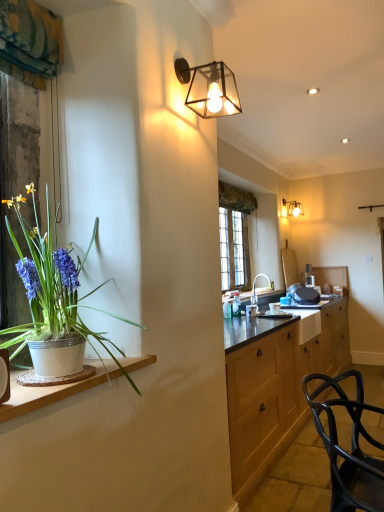
Question: Considering the positions of point click(x=296, y=205) and point click(x=8, y=416), is point click(x=296, y=205) closer or farther from the camera than point click(x=8, y=416)?

Choices:
 (A) closer
 (B) farther

Answer: (B)

Question: Is matte glass wall sconce at upper right, placed as the 1th lamp when sorted from back to front, wider or thinner than white ceramic pot at left?

Choices:
 (A) wide
 (B) thin

Answer: (B)

Question: Based on their relative distances, which object is farther from the white ceramic sink at center?

Choices:
 (A) matte glass lamp at upper center, the 1th lamp from the left
 (B) white ceramic pot at left
 (C) matte glass wall sconce at upper right, placed as the 1th lamp when sorted from back to front

Answer: (B)

Question: Estimate the real-world distances between objects in this image. Which object is farther from the white ceramic sink at center?

Choices:
 (A) white ceramic pot at left
 (B) matte glass lamp at upper center, placed as the 2th lamp when sorted from back to front
 (C) matte glass wall sconce at upper right, the 1th lamp from the right

Answer: (A)